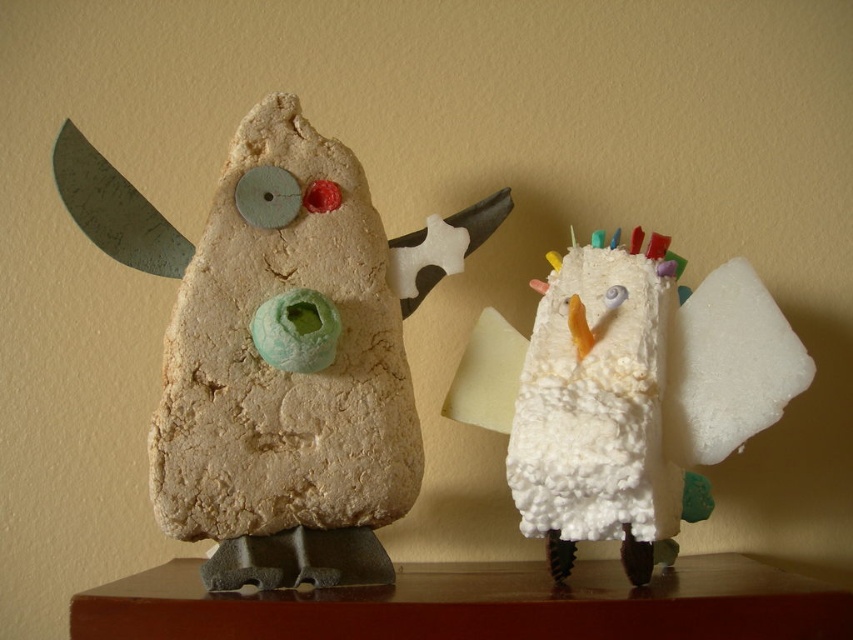
Question: Among these points, which one is farthest from the camera?

Choices:
 (A) (556, 451)
 (B) (317, 193)

Answer: (B)

Question: Does white fluffy bird at right appear under matte clay owl at left?

Choices:
 (A) yes
 (B) no

Answer: (A)

Question: Which point appears closest to the camera in this image?

Choices:
 (A) (552, 314)
 (B) (195, 502)

Answer: (B)

Question: Is white fluffy bird at right closer to the viewer compared to matte clay owl at left?

Choices:
 (A) no
 (B) yes

Answer: (B)

Question: Does white fluffy bird at right appear over matte clay owl at left?

Choices:
 (A) yes
 (B) no

Answer: (B)